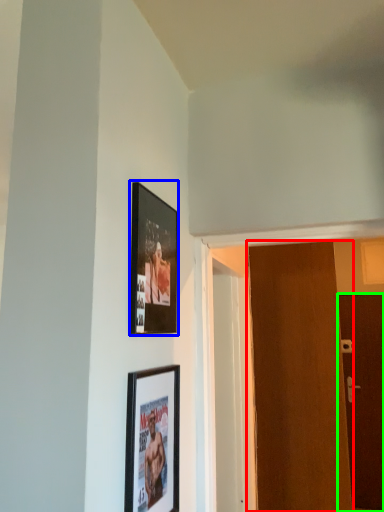
Question: Considering the real-world distances, which object is farthest from door (highlighted by a red box)? picture frame (highlighted by a blue box) or door (highlighted by a green box)?

Choices:
 (A) picture frame
 (B) door

Answer: (B)